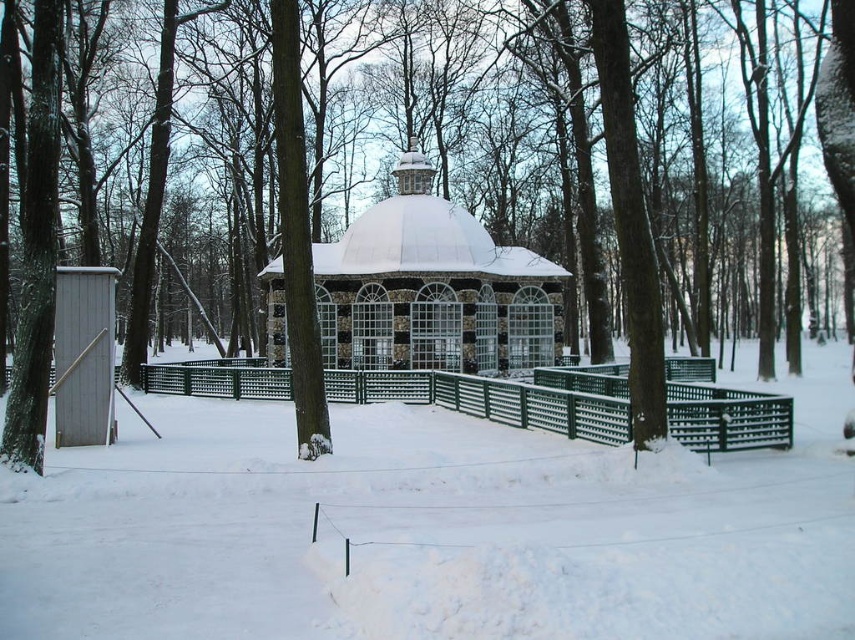
Is white fluffy snow at center smaller than green metal fence at center?

Yes.

Describe the element at coordinates (432, 529) in the screenshot. I see `white fluffy snow at center` at that location.

Image resolution: width=855 pixels, height=640 pixels. In order to click on white fluffy snow at center in this screenshot , I will do `click(432, 529)`.

Between brown textured tree at center and snow-covered stone gazebo at center, which one appears on the right side from the viewer's perspective?

From the viewer's perspective, brown textured tree at center appears more on the right side.

Is point (841, 122) closer to camera compared to point (461, 209)?

Yes.

Who is more forward, [264,241] or [381,355]?

Positioned in front is point [381,355].

At what (x,y) coordinates should I click in order to perform the action: click on brown textured tree at center. Please return your answer as a coordinate pair (x, y). Looking at the image, I should click on (469, 241).

This screenshot has width=855, height=640. Identify the location of white fluffy snow at center. (432, 529).

Which is below, white fluffy snow at center or snow-covered stone gazebo at center?

white fluffy snow at center is lower down.

Which is in front, point (175, 522) or point (544, 269)?

Point (175, 522) is in front.

Find the location of a particular element. This screenshot has height=640, width=855. white fluffy snow at center is located at coordinates (432, 529).